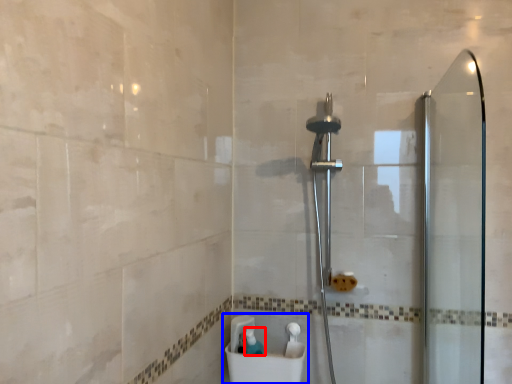
Question: Which object appears closest to the camera in this image, toiletry (highlighted by a red box) or sink (highlighted by a blue box)?

Choices:
 (A) toiletry
 (B) sink

Answer: (B)